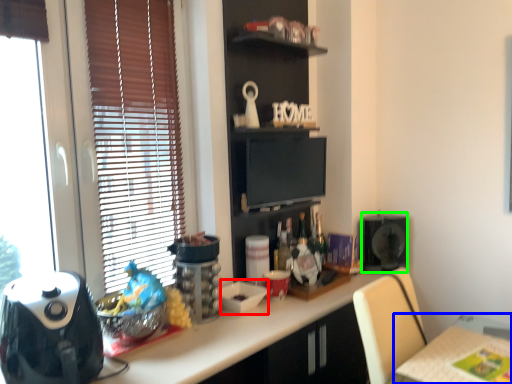
Question: Which is farther away from appliance (highlighted by a red box)? table (highlighted by a blue box) or appliance (highlighted by a green box)?

Choices:
 (A) table
 (B) appliance

Answer: (B)